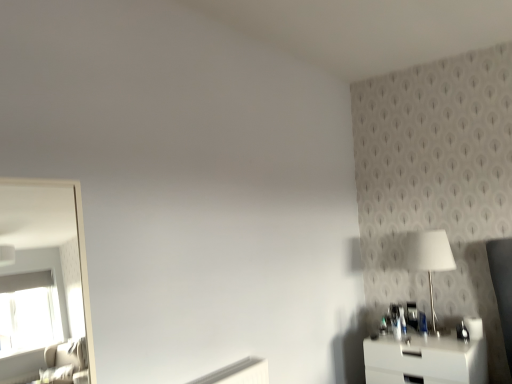
Question: In terms of height, does white glossy nightstand at lower right look taller or shorter compared to white glossy table lamp at right?

Choices:
 (A) short
 (B) tall

Answer: (A)

Question: From a real-world perspective, is white glossy nightstand at lower right physically located above or below white glossy table lamp at right?

Choices:
 (A) above
 (B) below

Answer: (B)

Question: From the image's perspective, is white glossy nightstand at lower right located above or below white glossy table lamp at right?

Choices:
 (A) below
 (B) above

Answer: (A)

Question: In the image, is white glossy table lamp at right positioned in front of or behind white glossy nightstand at lower right?

Choices:
 (A) front
 (B) behind

Answer: (B)

Question: From a real-world perspective, is white glossy table lamp at right physically located above or below white glossy nightstand at lower right?

Choices:
 (A) below
 (B) above

Answer: (B)

Question: Looking at the image, does white glossy table lamp at right seem bigger or smaller compared to white glossy nightstand at lower right?

Choices:
 (A) big
 (B) small

Answer: (B)

Question: From their relative heights in the image, would you say white glossy table lamp at right is taller or shorter than white glossy nightstand at lower right?

Choices:
 (A) short
 (B) tall

Answer: (B)